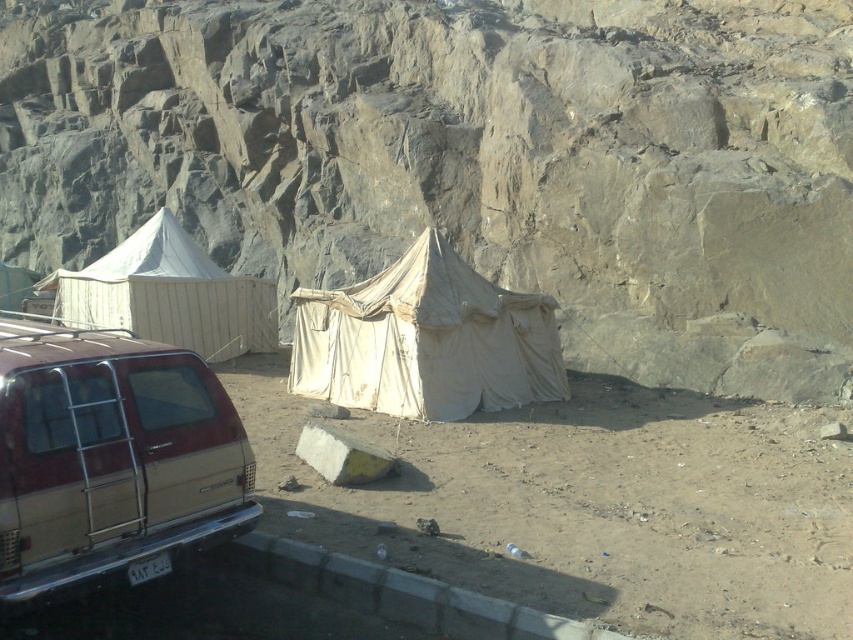
Consider the image. You are planning to set up a new tent in this area. The beige canvas tent at center is already placed. Considering the rough stone rock face at upper center is 7.72 meters away, is there enough space between them to safely pitch another tent?

The distance between the rough stone rock face at upper center and the beige canvas tent at center is 7.72 meters. To safely pitch another tent, you need to ensure that the new tent is placed at a safe distance from both the rock face and the existing tent. However, without knowing the required safety distance or the size of the new tent, it is difficult to determine if there is enough space. Please provide more information about the safety requirements or the dimensions of the new tent.

You are planning to park your new car next to the maroon beige minivan at lower left and the beige canvas tent at center. Based on their sizes, which vehicle or tent can you park closer to the curb without overlapping?

The maroon beige minivan at lower left has a smaller width than the beige canvas tent at center, so you can park the maroon beige minivan at lower left closer to the curb since it takes up less space.